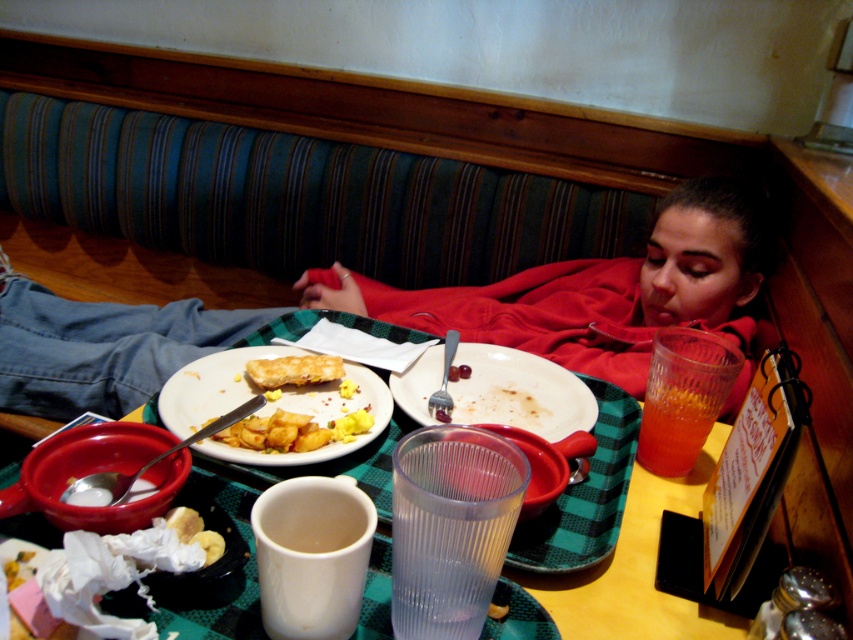
Question: From the image, what is the correct spatial relationship of translucent glass water at center in relation to golden brown pastry at lower left?

Choices:
 (A) above
 (B) below

Answer: (A)

Question: Among these points, which one is farthest from the camera?

Choices:
 (A) (659, 428)
 (B) (187, 531)
 (C) (631, 588)
 (D) (283, 372)

Answer: (D)

Question: Does translucent glass water at center have a smaller size compared to matte yellow plate at center?

Choices:
 (A) yes
 (B) no

Answer: (B)

Question: Which point appears closest to the camera in this image?

Choices:
 (A) (737, 188)
 (B) (677, 433)
 (C) (338, 522)
 (D) (532, 397)

Answer: (C)

Question: Can you confirm if white matte plate at center is positioned below translucent glass drink at upper right?

Choices:
 (A) no
 (B) yes

Answer: (A)

Question: Estimate the real-world distances between objects in this image. Which object is farther from the red hoodie at upper center?

Choices:
 (A) translucent glass water at center
 (B) golden crispy pastry at center
 (C) white ceramic mug at lower center

Answer: (C)